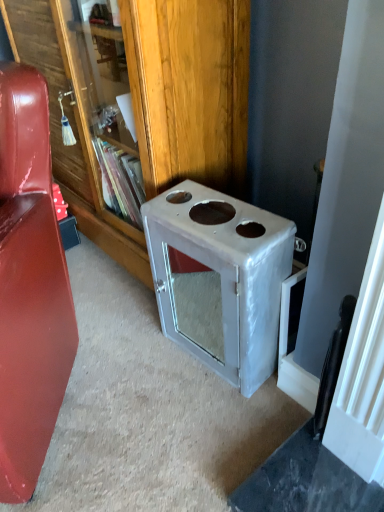
Question: From the image's perspective, is metallic silver bookcase at center positioned above or below glossy leather couch at left?

Choices:
 (A) below
 (B) above

Answer: (B)

Question: Does point (190, 53) appear closer or farther from the camera than point (61, 388)?

Choices:
 (A) closer
 (B) farther

Answer: (A)

Question: Estimate the real-world distances between objects in this image. Which object is farther from the white glossy stove at center?

Choices:
 (A) glossy leather couch at left
 (B) metallic silver bookcase at center

Answer: (A)

Question: Estimate the real-world distances between objects in this image. Which object is farther from the glossy leather couch at left?

Choices:
 (A) metallic silver bookcase at center
 (B) white glossy stove at center

Answer: (A)